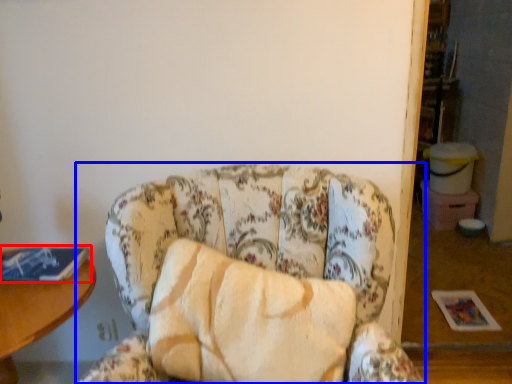
Question: Which object is further to the camera taking this photo, book (highlighted by a red box) or chair (highlighted by a blue box)?

Choices:
 (A) book
 (B) chair

Answer: (A)